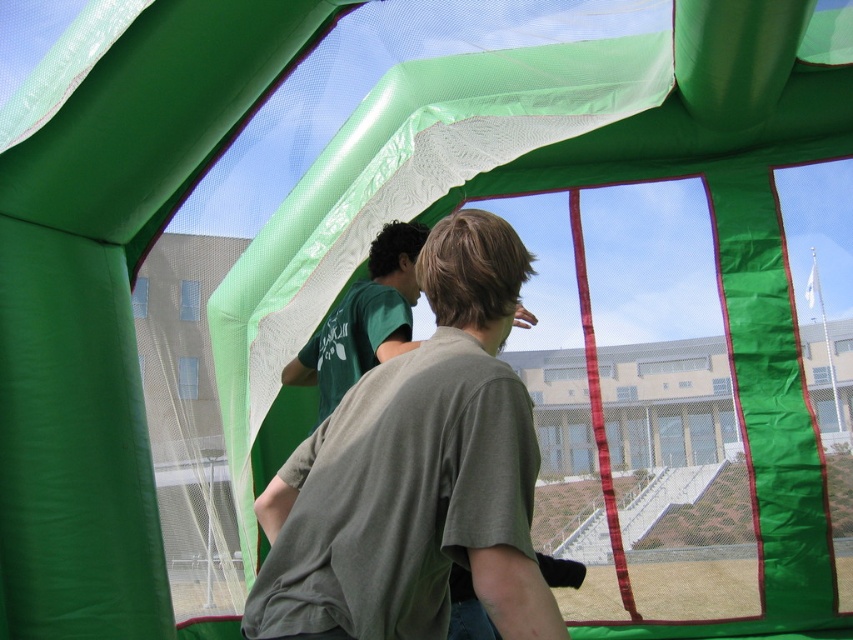
Which is more to the right, green matte t-shirt at center or green matte t-shirt at upper left?

From the viewer's perspective, green matte t-shirt at center appears more on the right side.

Between point (358, 557) and point (291, 376), which one is positioned behind?

Positioned behind is point (291, 376).

Where is `green matte t-shirt at center`? This screenshot has height=640, width=853. green matte t-shirt at center is located at coordinates (416, 474).